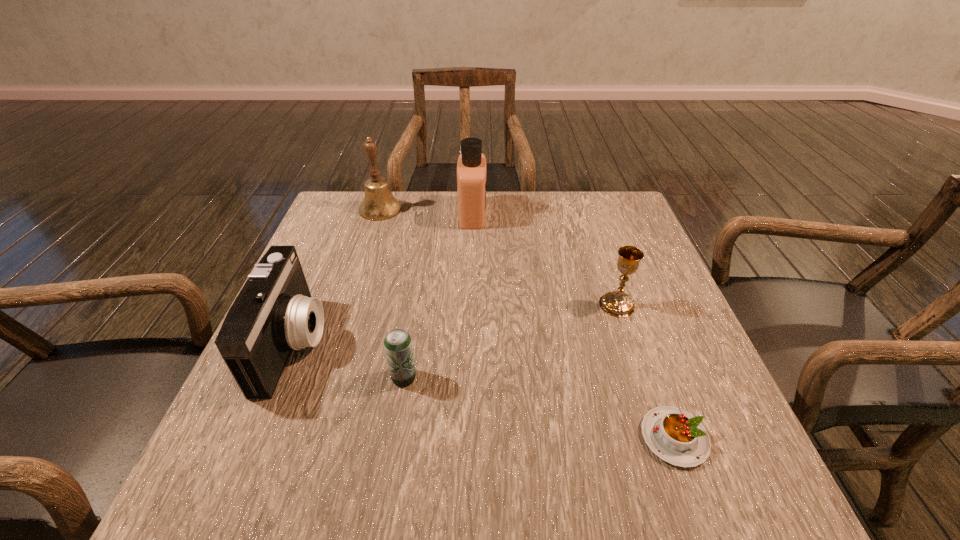
The height and width of the screenshot is (540, 960). Identify the location of free space between the bell and the beer can. (393, 293).

I want to click on vacant area between the chalice and the perfume, so click(545, 259).

The height and width of the screenshot is (540, 960). I want to click on free space between the camcorder and the chalice, so click(456, 324).

Locate an element on the screen. This screenshot has height=540, width=960. empty space between the second shortest object and the chalice is located at coordinates (511, 341).

Where is `free space between the fourth object from right to left and the nearest object`? The image size is (960, 540). free space between the fourth object from right to left and the nearest object is located at coordinates (540, 408).

This screenshot has height=540, width=960. Identify the location of free point between the fourth object from left to right and the beer can. (438, 296).

Image resolution: width=960 pixels, height=540 pixels. In order to click on vacant area that lies between the camcorder and the fifth tallest object in this screenshot , I will do `click(349, 361)`.

Identify the location of free space between the bell and the third object from right to left. The width and height of the screenshot is (960, 540). (426, 212).

Locate an element on the screen. The height and width of the screenshot is (540, 960). free space between the third object from right to left and the pudding is located at coordinates (573, 326).

Identify the location of the fourth closest object to the nearest object. This screenshot has width=960, height=540. (471, 167).